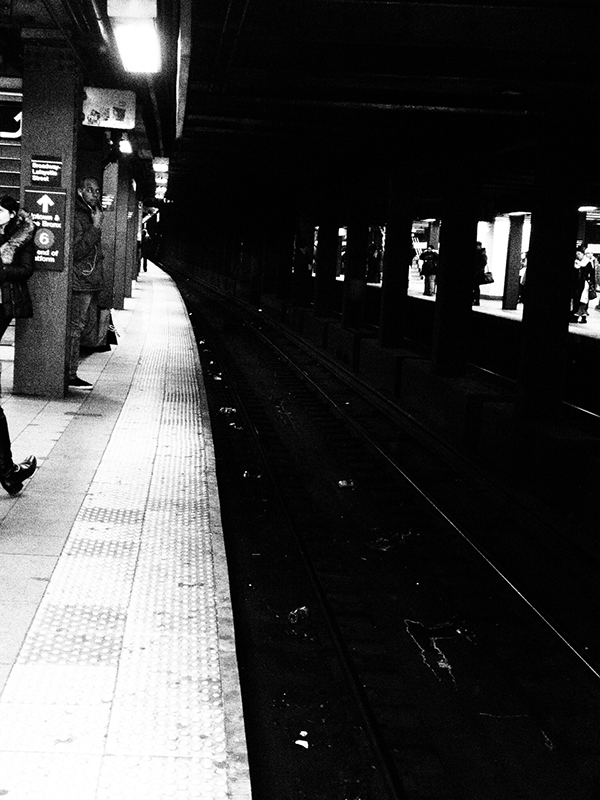
At what (x,y) coordinates should I click in order to perform the action: click on stairs. Please return your answer as a coordinate pair (x, y). This screenshot has height=800, width=600. Looking at the image, I should click on (11, 158), (412, 270).